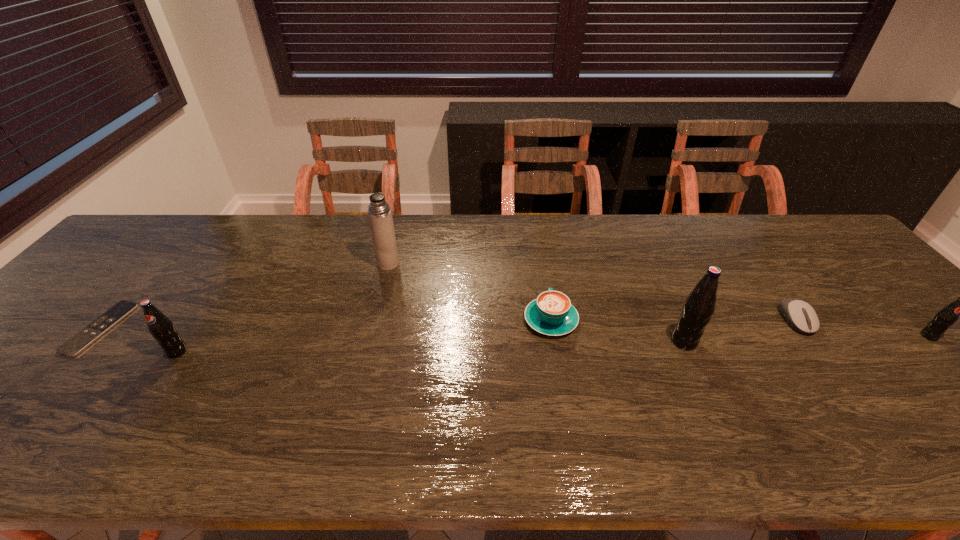
Identify the location of the leftmost pop. pyautogui.click(x=162, y=329).

This screenshot has width=960, height=540. I want to click on the third tallest object, so click(x=162, y=329).

What are the coordinates of `the second pop from right to left` in the screenshot? It's located at (x=699, y=306).

Find the location of a particular element. This screenshot has width=960, height=540. the fifth object from left to right is located at coordinates (699, 306).

Locate an element on the screen. the shortest pop is located at coordinates (946, 317).

Find the location of a particular element. Image resolution: width=960 pixels, height=540 pixels. the fourth tallest object is located at coordinates (946, 317).

Image resolution: width=960 pixels, height=540 pixels. I want to click on remote control, so click(x=84, y=338).

This screenshot has width=960, height=540. Identify the location of the leftmost object. (84, 338).

Locate an element on the screen. the fourth object from right to left is located at coordinates (552, 313).

The width and height of the screenshot is (960, 540). I want to click on cappuccino, so click(552, 313).